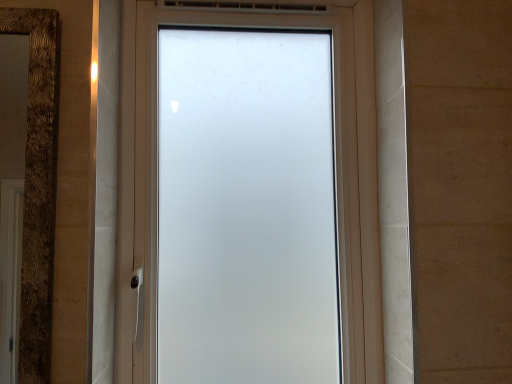
This screenshot has width=512, height=384. Describe the element at coordinates (336, 164) in the screenshot. I see `frosted glass door at center` at that location.

Find the location of a particular element. This screenshot has width=512, height=384. frosted glass door at center is located at coordinates (336, 164).

You are a GUI agent. You are given a task and a screenshot of the screen. Output one action in this format:
    pyautogui.click(x=<x>, y=<y>)
    Task: Click on the frosted glass door at center
    The height and width of the screenshot is (384, 512).
    Given the screenshot: What is the action you would take?
    pyautogui.click(x=336, y=164)